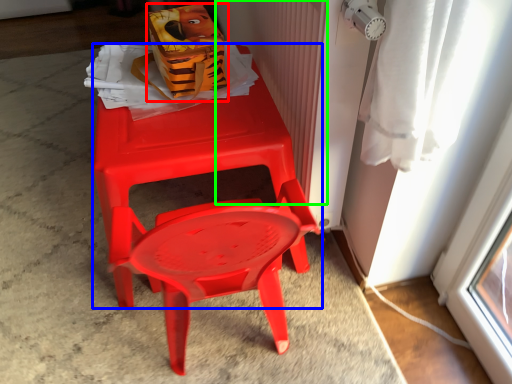
Question: Based on their relative distances, which object is farther from lunch box (highlighted by a red box)? Choose from chair (highlighted by a blue box) and radiator (highlighted by a green box).

Choices:
 (A) chair
 (B) radiator

Answer: (B)